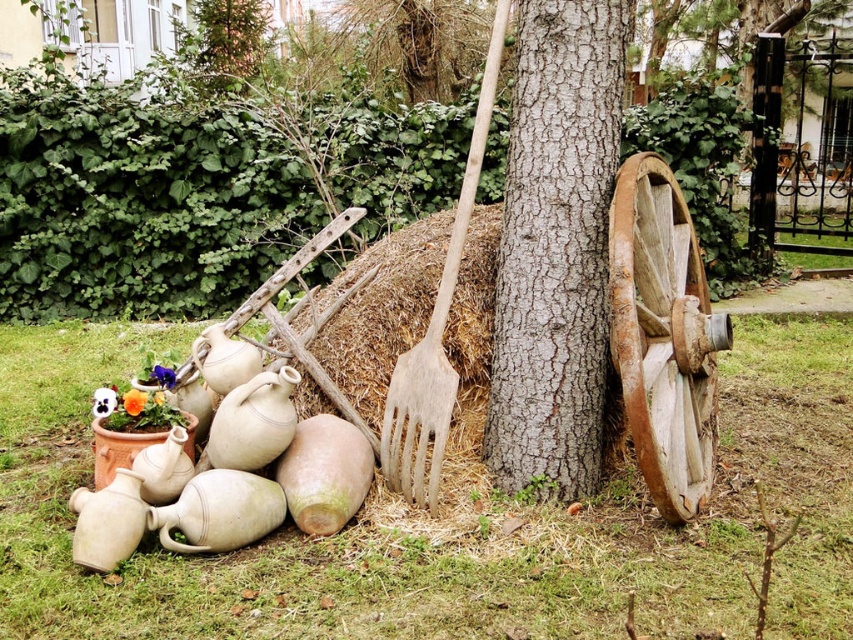
From the picture: Based on the scene description, what are the coordinates of the brown textured tree trunk at center?

The coordinates of the brown textured tree trunk at center are at point (419,42).

You are standing at the center of the garden, and you see a point marked at coordinates (419, 42). According to the scene, what object is this point located on?

The point at (419, 42) is located on the brown textured tree trunk at center.

You are a gardener standing in front of the brown textured tree trunk at center and the wooden fork at center. Which object is closer to you?

The wooden fork at center is closer to the viewer than the brown textured tree trunk at center, so the wooden fork at center is closer to you.